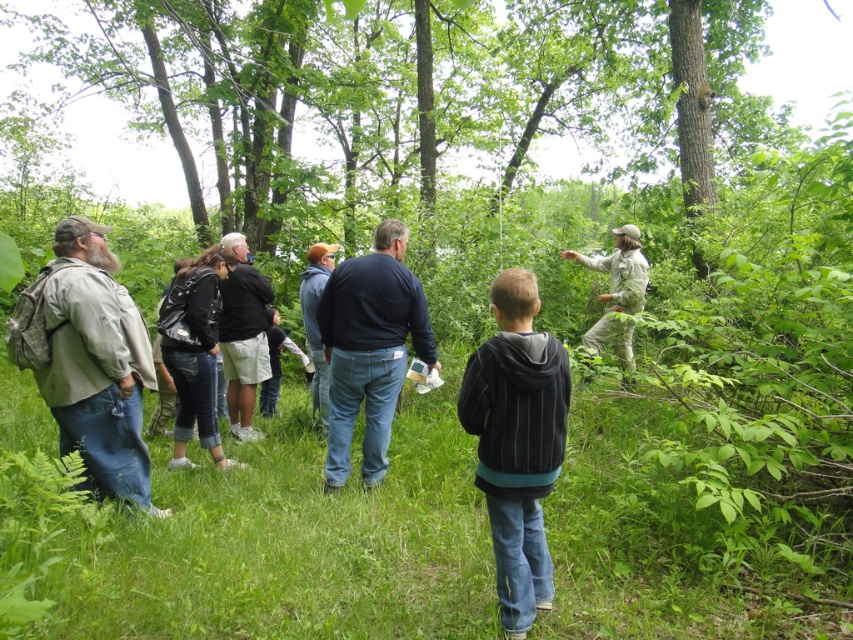
Does camouflage backpack at left have a greater height compared to khaki fabric jacket at center?

Correct, camouflage backpack at left is much taller as khaki fabric jacket at center.

Looking at this image, is camouflage backpack at left further to the viewer compared to khaki fabric jacket at center?

No, it is in front of khaki fabric jacket at center.

Who is more distant from viewer, (107,481) or (630,308)?

The point (630,308) is more distant.

The width and height of the screenshot is (853, 640). In order to click on camouflage backpack at left in this screenshot , I will do `click(97, 364)`.

Which is more to the left, dark blue sweater at center or blue denim jeans at center?

From the viewer's perspective, blue denim jeans at center appears more on the left side.

Can you confirm if dark blue sweater at center is shorter than blue denim jeans at center?

No, dark blue sweater at center is not shorter than blue denim jeans at center.

Identify the location of dark blue sweater at center. This screenshot has height=640, width=853. (369, 348).

Does dark blue sweater at center appear on the left side of black leather jacket at center?

No, dark blue sweater at center is not to the left of black leather jacket at center.

Does dark blue sweater at center appear on the right side of black leather jacket at center?

Indeed, dark blue sweater at center is positioned on the right side of black leather jacket at center.

Between point (361, 349) and point (209, 253), which one is positioned in front?

Positioned in front is point (361, 349).

At what (x,y) coordinates should I click in order to perform the action: click on dark blue sweater at center. Please return your answer as a coordinate pair (x, y). The image size is (853, 640). Looking at the image, I should click on (369, 348).